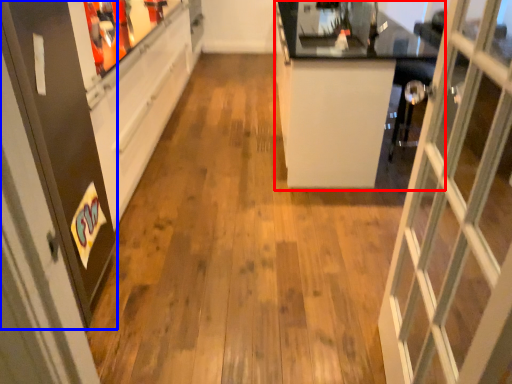
Question: Which of the following is the farthest to the observer, counter (highlighted by a red box) or screen door (highlighted by a blue box)?

Choices:
 (A) counter
 (B) screen door

Answer: (A)